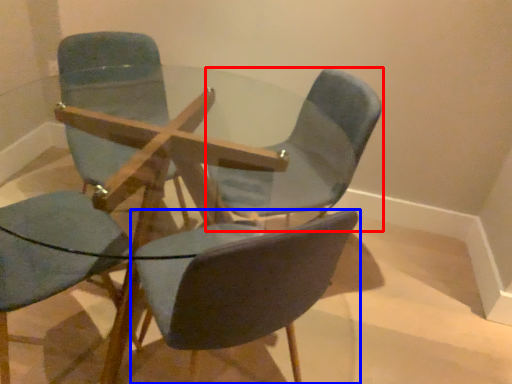
Question: Which object is closer to the camera taking this photo, chair (highlighted by a red box) or chair (highlighted by a blue box)?

Choices:
 (A) chair
 (B) chair

Answer: (B)